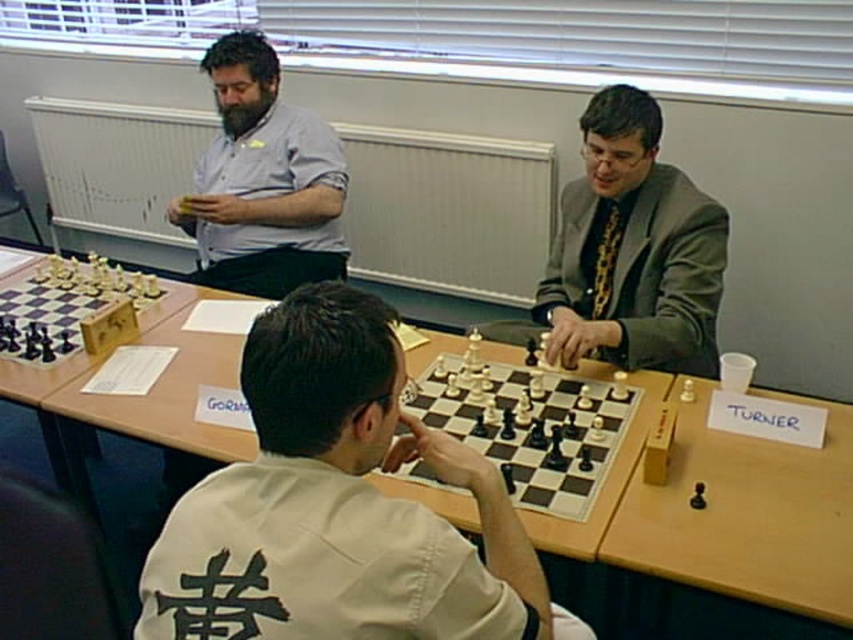
Does wooden chessboard at center appear on the left side of metallic chess set at left?

In fact, wooden chessboard at center is to the right of metallic chess set at left.

Between wooden chessboard at center and metallic chess set at left, which one has more height?

wooden chessboard at center

You are a GUI agent. You are given a task and a screenshot of the screen. Output one action in this format:
    pyautogui.click(x=<x>, y=<y>)
    Task: Click on the wooden chessboard at center
    Image resolution: width=853 pixels, height=640 pixels.
    Given the screenshot: What is the action you would take?
    pyautogui.click(x=671, y=609)

Find the location of a particular element. Image resolution: width=853 pixels, height=640 pixels. wooden chessboard at center is located at coordinates (671, 609).

Who is more forward, (227, 202) or (558, 486)?

Positioned in front is point (558, 486).

Looking at this image, who is positioned more to the left, matte gray shirt at upper left or white wooden chessboard at center?

From the viewer's perspective, matte gray shirt at upper left appears more on the left side.

Between point (282, 180) and point (434, 380), which one is positioned behind?

The point (282, 180) is behind.

At what (x,y) coordinates should I click in order to perform the action: click on matte gray shirt at upper left. Please return your answer as a coordinate pair (x, y). This screenshot has width=853, height=640. Looking at the image, I should click on (262, 180).

Does matte gray suit at center lie behind wooden chessboard at center?

Yes, it is behind wooden chessboard at center.

Is point (611, 132) farther from viewer compared to point (618, 620)?

No, it is in front of (618, 620).

You are a GUI agent. You are given a task and a screenshot of the screen. Output one action in this format:
    pyautogui.click(x=<x>, y=<y>)
    Task: Click on the matte gray suit at center
    
    Given the screenshot: What is the action you would take?
    pyautogui.click(x=633, y=250)